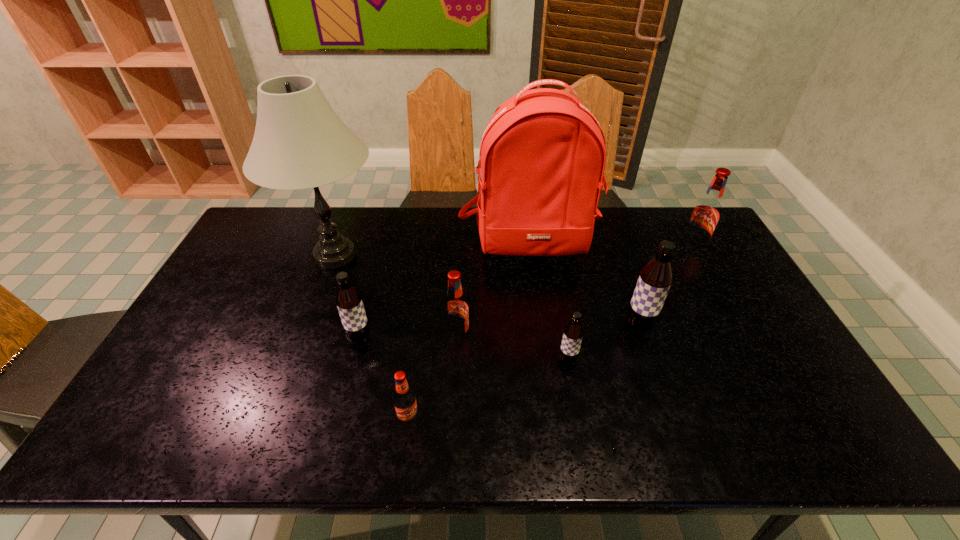
I want to click on brown root beer that is the second closest one to the leftmost brown root beer, so click(655, 279).

Locate an element on the screen. The width and height of the screenshot is (960, 540). vacant area in the image that satisfies the following two spatial constraints: 1. on the front side of the seventh farthest object; 2. on the right side of the fourth root beer from right to left is located at coordinates (456, 361).

Identify the location of free spot that satisfies the following two spatial constraints: 1. on the main compartment of the red backpack; 2. on the right side of the smallest brown root beer. This screenshot has height=540, width=960. (545, 361).